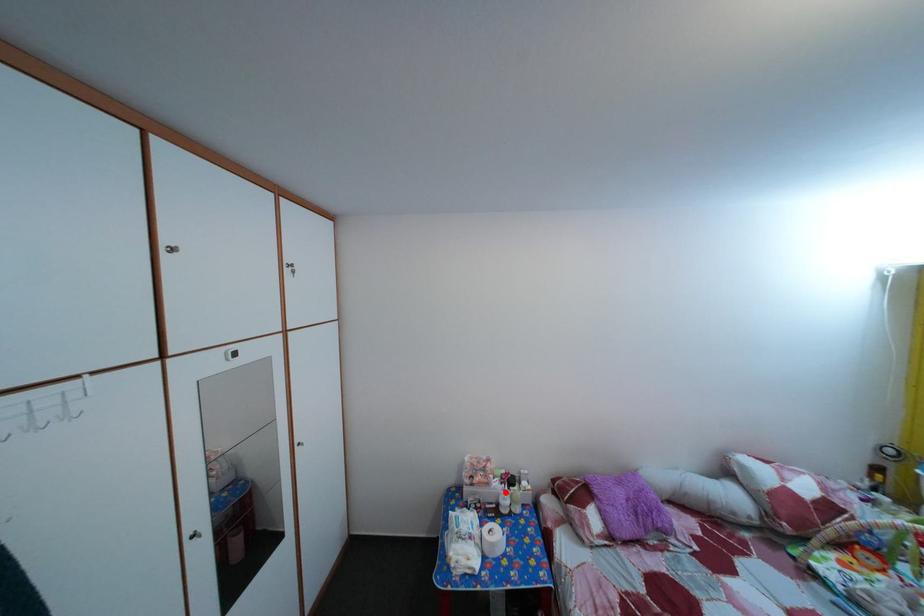
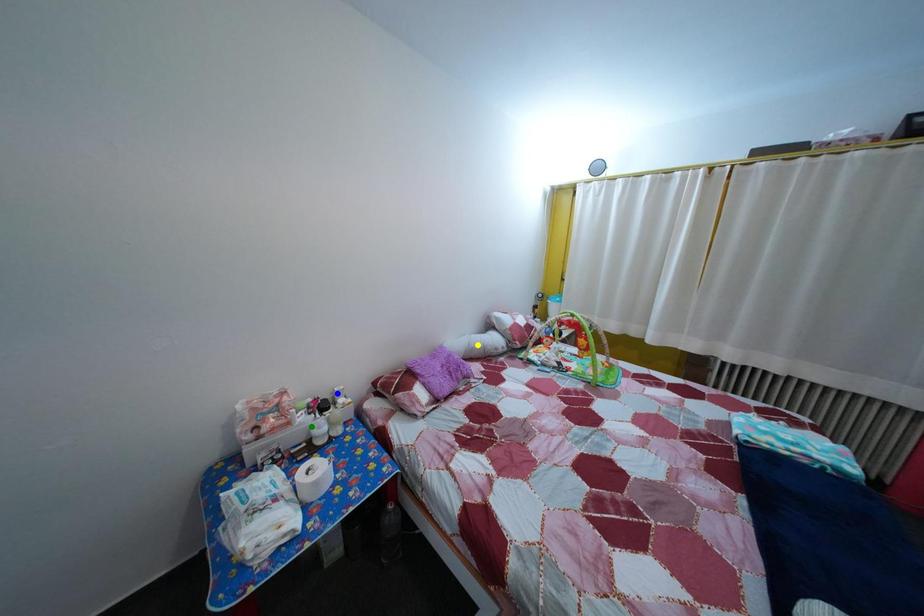
Question: I am providing you with two images of the same scene from different viewpoints. A red point is marked on the first image. You are given multiple points on the second image. Which point in image 2 represents the same 3d spot as the red point in image 1?

Choices:
 (A) blue point
 (B) yellow point
 (C) green point

Answer: (C)